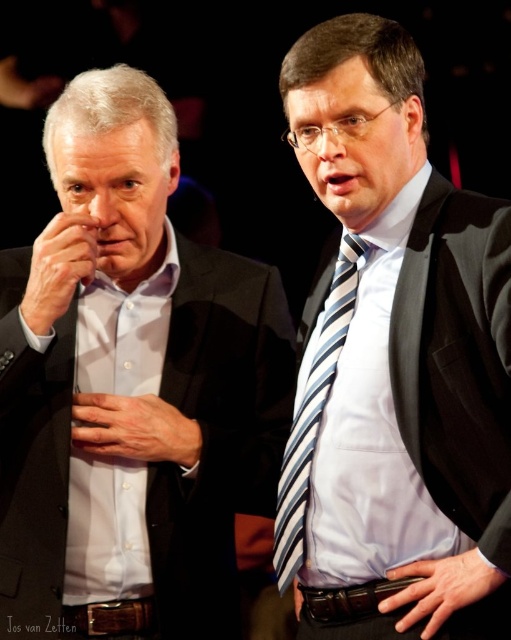
Looking at this image, you are standing in a room and see the matte black suit at center. If you want to reach it without moving your feet, what is the minimum height you need to be?

The matte black suit at center is 4.10 feet away from the viewer, but the question asks about height. The provided information only specifies distance, not height. Therefore, the given data cannot determine the required height.

Based on the scene description, can you determine if the matte black suit at center is positioned above or below the smooth skin hand at left?

The matte black suit at center is located below the smooth skin hand at left.